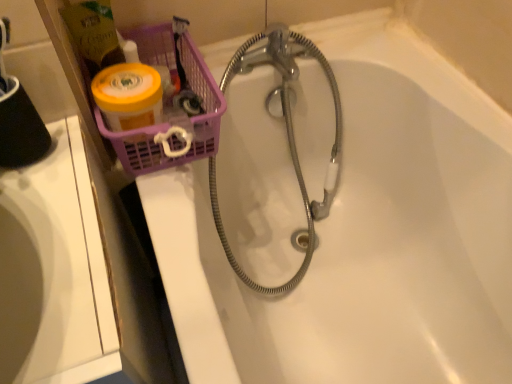
Question: Does translucent plastic basket at upper left have a lesser height compared to white glossy bathtub at upper center?

Choices:
 (A) yes
 (B) no

Answer: (A)

Question: From the image's perspective, does translucent plastic basket at upper left appear lower than white glossy bathtub at upper center?

Choices:
 (A) no
 (B) yes

Answer: (A)

Question: Is translucent plastic basket at upper left closer to the viewer compared to white glossy bathtub at upper center?

Choices:
 (A) yes
 (B) no

Answer: (B)

Question: From a real-world perspective, is translucent plastic basket at upper left below white glossy bathtub at upper center?

Choices:
 (A) no
 (B) yes

Answer: (A)

Question: Can you see translucent plastic basket at upper left touching white glossy bathtub at upper center?

Choices:
 (A) no
 (B) yes

Answer: (A)

Question: Is translucent plastic basket at upper left in front of or behind white glossy bathtub at upper center in the image?

Choices:
 (A) front
 (B) behind

Answer: (B)

Question: From a real-world perspective, is translucent plastic basket at upper left physically located above or below white glossy bathtub at upper center?

Choices:
 (A) below
 (B) above

Answer: (B)

Question: Is point (131, 162) closer or farther from the camera than point (483, 218)?

Choices:
 (A) farther
 (B) closer

Answer: (B)

Question: Visually, is translucent plastic basket at upper left positioned to the left or to the right of white glossy bathtub at upper center?

Choices:
 (A) left
 (B) right

Answer: (A)

Question: Which is correct: white glossy bathtub at upper center is inside translucent plastic basket at upper left, or outside of it?

Choices:
 (A) inside
 (B) outside

Answer: (B)

Question: Is white glossy bathtub at upper center to the left or to the right of translucent plastic basket at upper left in the image?

Choices:
 (A) right
 (B) left

Answer: (A)

Question: Considering the positions of white glossy bathtub at upper center and translucent plastic basket at upper left in the image, is white glossy bathtub at upper center wider or thinner than translucent plastic basket at upper left?

Choices:
 (A) wide
 (B) thin

Answer: (A)

Question: Based on their sizes in the image, would you say white glossy bathtub at upper center is bigger or smaller than translucent plastic basket at upper left?

Choices:
 (A) small
 (B) big

Answer: (B)

Question: Considering the positions of point (32, 263) and point (444, 284), is point (32, 263) closer or farther from the camera than point (444, 284)?

Choices:
 (A) closer
 (B) farther

Answer: (A)

Question: In the image, is white glossy sink at left on the left side or the right side of white glossy bathtub at upper center?

Choices:
 (A) left
 (B) right

Answer: (A)